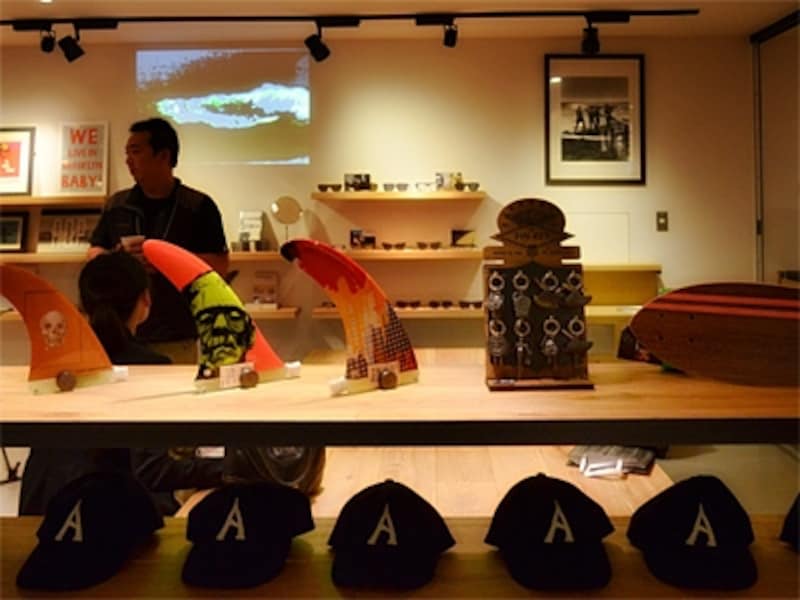
The image size is (800, 600). What are the coordinates of `cup` in the screenshot? It's located at (129, 243).